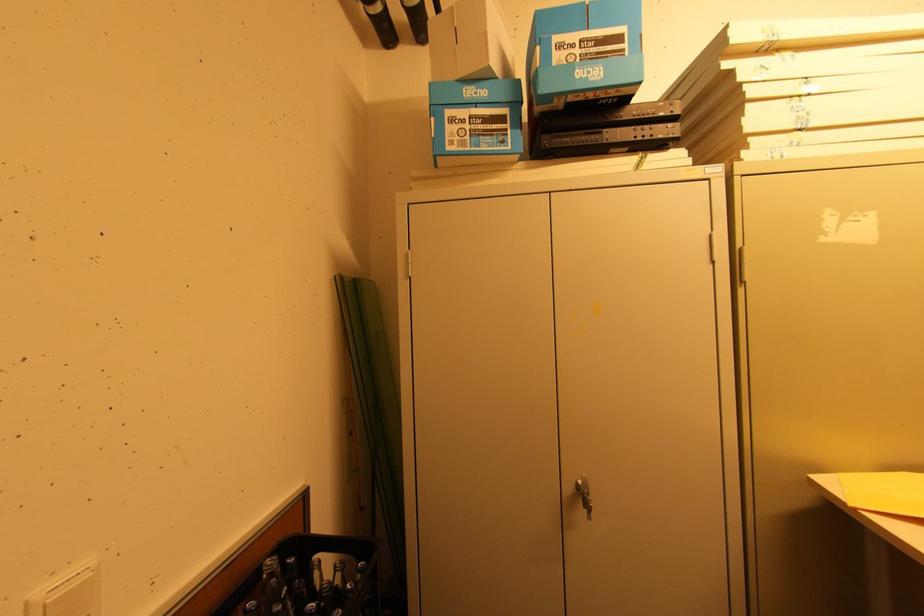
The height and width of the screenshot is (616, 924). Find the location of `key in cabinet lock`. key in cabinet lock is located at coordinates (582, 514).